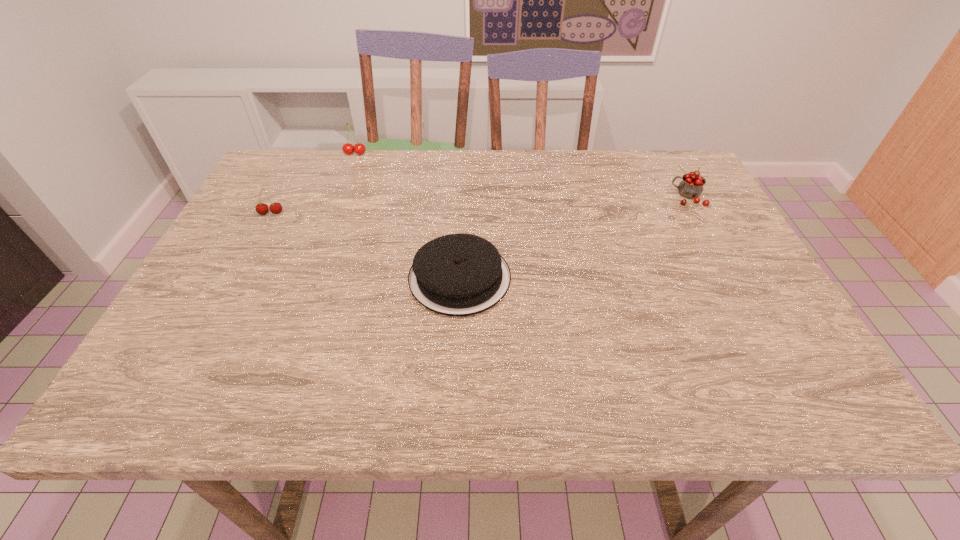
Identify the location of free point located on the handle side of the second nearest cherry. (549, 197).

The image size is (960, 540). Find the location of `vacant space located 0.060m on the handle side of the second nearest cherry`. vacant space located 0.060m on the handle side of the second nearest cherry is located at coordinates (647, 197).

What are the coordinates of `vacant area located on the surface of the nearest cherry` in the screenshot? It's located at (235, 281).

You are a GUI agent. You are given a task and a screenshot of the screen. Output one action in this format:
    pyautogui.click(x=<x>, y=<y>)
    Task: Click on the vacant space located 0.260m on the right of the nearest object
    This screenshot has width=960, height=540.
    Given the screenshot: What is the action you would take?
    pyautogui.click(x=630, y=278)

Where is `object that is at the left edge`? The height and width of the screenshot is (540, 960). object that is at the left edge is located at coordinates (275, 208).

The image size is (960, 540). In order to click on object that is positioned at the right edge in this screenshot , I will do `click(691, 186)`.

This screenshot has height=540, width=960. I want to click on object that is at the far right corner, so click(691, 186).

This screenshot has width=960, height=540. In the image, there is a desktop. In order to click on free space at the far edge in this screenshot , I will do click(334, 181).

Find the location of a particular element. vacant space at the near edge of the desktop is located at coordinates (275, 386).

This screenshot has height=540, width=960. Identify the location of free location at the right edge of the desktop. (734, 252).